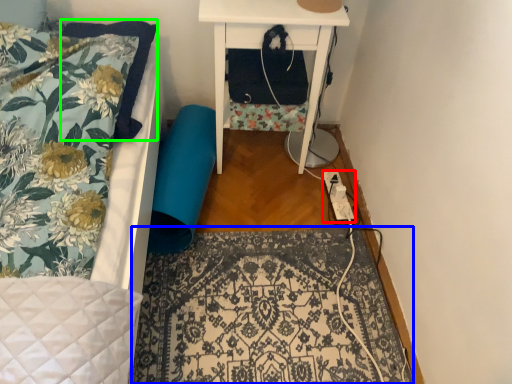
Question: Considering the real-world distances, which object is closest to extension cord (highlighted by a red box)? mat (highlighted by a blue box) or pillow (highlighted by a green box).

Choices:
 (A) mat
 (B) pillow

Answer: (A)